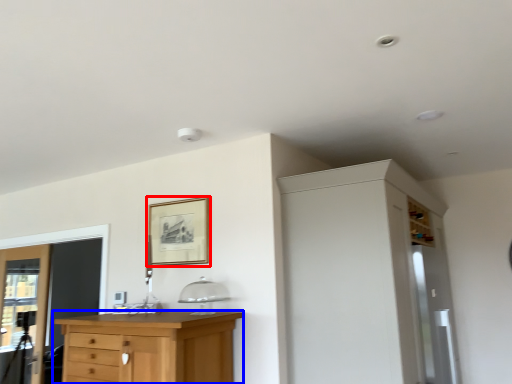
Question: Which object appears farthest to the camera in this image, picture frame (highlighted by a red box) or chest of drawers (highlighted by a blue box)?

Choices:
 (A) picture frame
 (B) chest of drawers

Answer: (A)